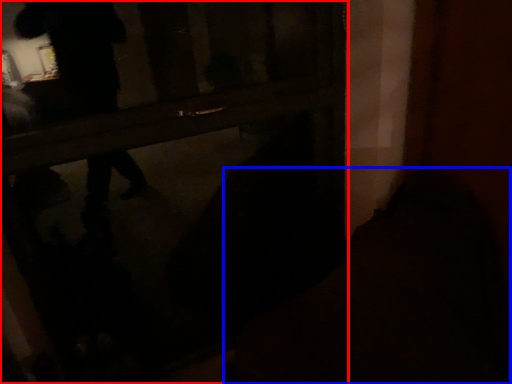
Question: Which point is further to the camera, door (highlighted by a red box) or dark (highlighted by a blue box)?

Choices:
 (A) door
 (B) dark

Answer: (A)